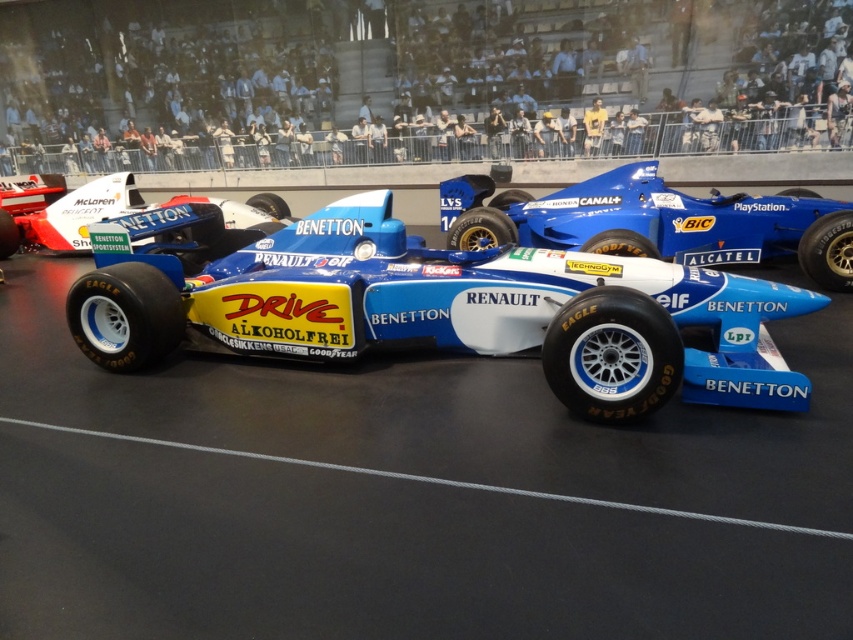
You are a visitor at the Formula One exhibit and want to take a photo of both the blue rubber race track at center and the matte white race car at center. Since the glass barrier is reflective, you need to position yourself so that the reflection doesn not interfere. Based on their positions, which object should you focus on first to avoid the reflection?

The blue rubber race track at center is to the right of the matte white race car at center. To avoid the reflection from the glass barrier, you should focus on the matte white race car at center first since it is closer to your left side, away from the reflective barrier.

You are a visitor standing in front of the Formula One racing car exhibit. You see the blue rubber race track at center and the blue glossy race car at center. Which object is positioned closer to you?

The blue rubber race track at center is closer to the viewer than the blue glossy race car at center.

Based on the photo, you are a visitor at the museum and want to take a photo of the blue rubber race track at center. Where should you stand to ensure it is centered in your camera viewfinder?

The blue rubber race track at center is located at point coordinates approximately 0.645 on the x axis and 0.492 on the y axis, so you should position yourself directly in front of that coordinate to center it in your camera viewfinder.